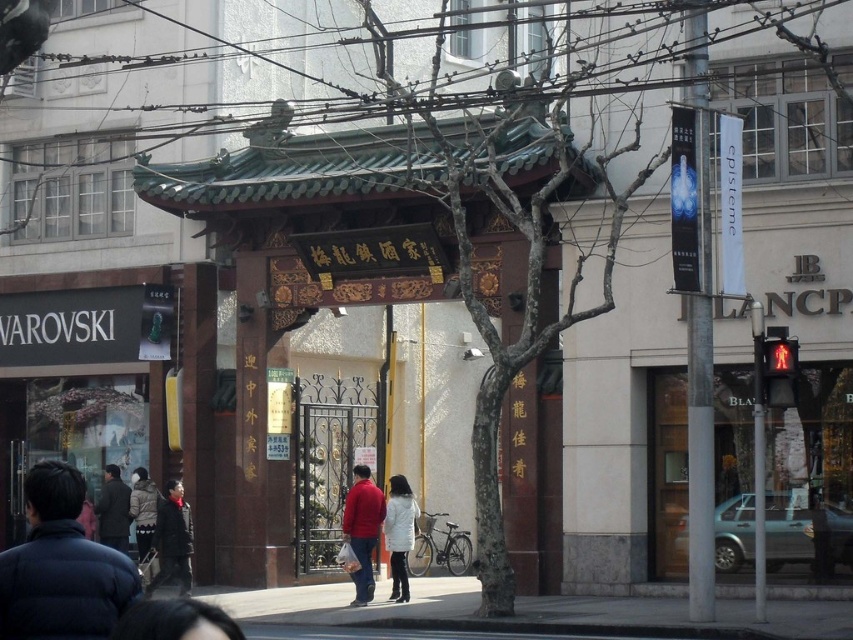
You are a customer trying to decide between two coats in a store. You see the red matte jacket at center and the dark brown coat at center. Which one is more likely to be a winter coat based on their thickness?

The dark brown coat at center is thicker than the red matte jacket at center, so it is more likely to be a winter coat.

You are a customer in the store and want to try on both the dark gray coat at center and the white wool coat at center. Which coat should you pick up first if you want to start with the one closer to the left side?

The dark gray coat at center is to the left of the white wool coat at center, so you should pick up the dark gray coat at center first.

You are standing on the gray concrete pavement at lower center and want to reach the white wool coat at center. Which direction should you move to get closer to the coat?

Since the gray concrete pavement at lower center is to the right of the white wool coat at center, you should move to your left to get closer to the coat.